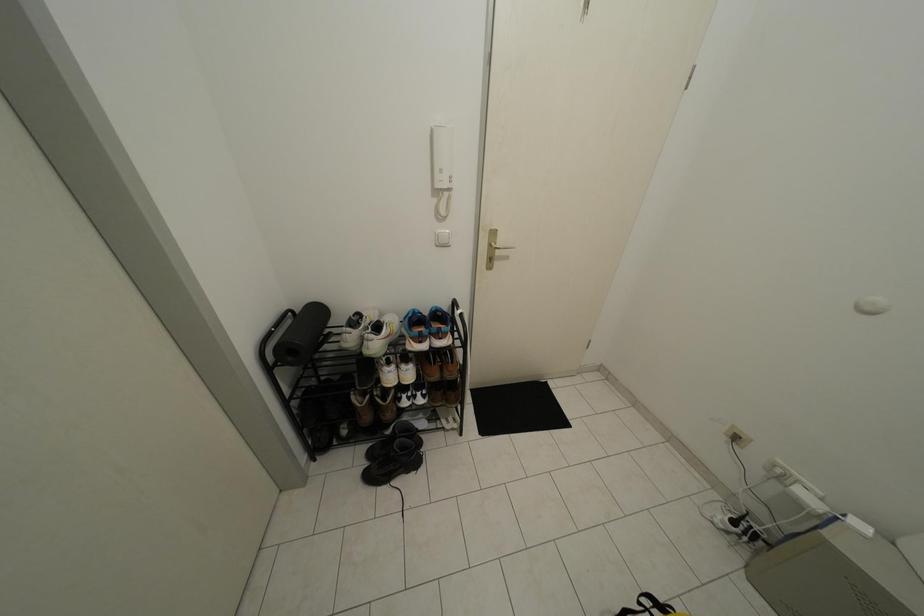
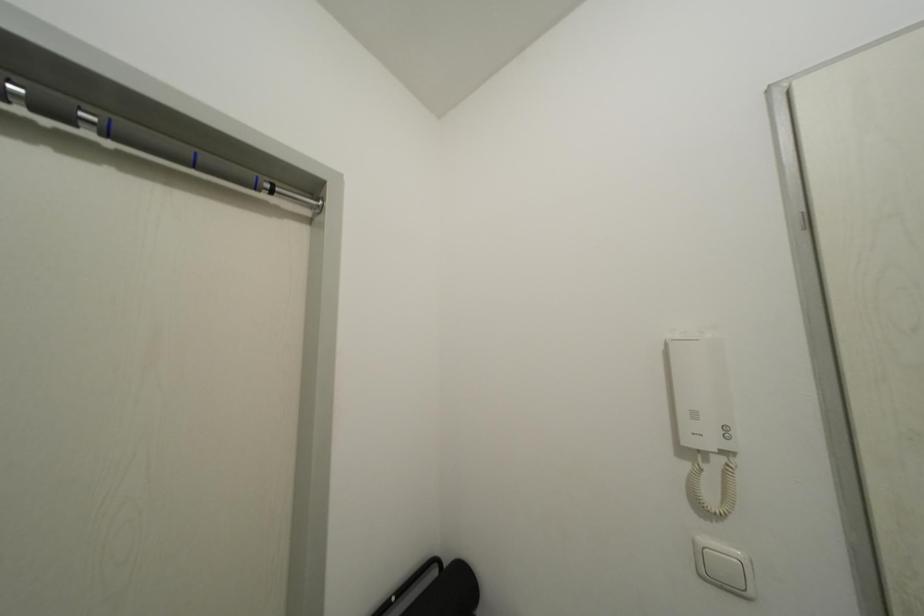
Based on the continuous images, in which direction is the camera rotating?

The rotation direction of the camera is left-up.